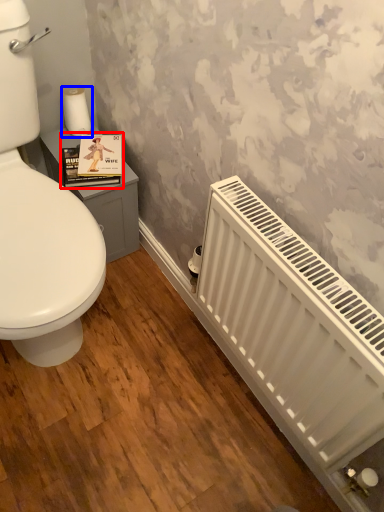
Question: Among these objects, which one is nearest to the camera, book cover (highlighted by a red box) or toilet paper (highlighted by a blue box)?

Choices:
 (A) book cover
 (B) toilet paper

Answer: (A)